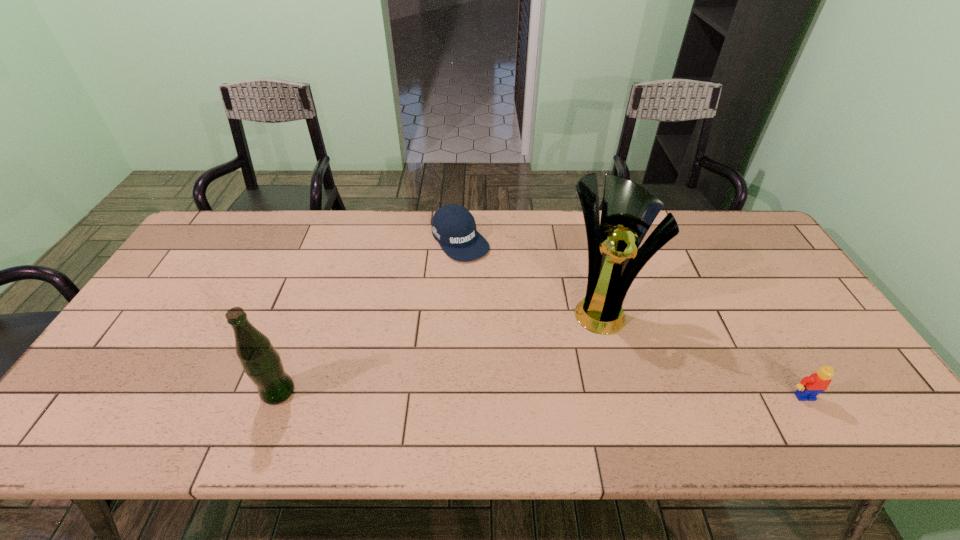
Find the location of a particular element. free spot that satisfies the following two spatial constraints: 1. on the back side of the second object from right to left; 2. on the left side of the beer bottle is located at coordinates (310, 308).